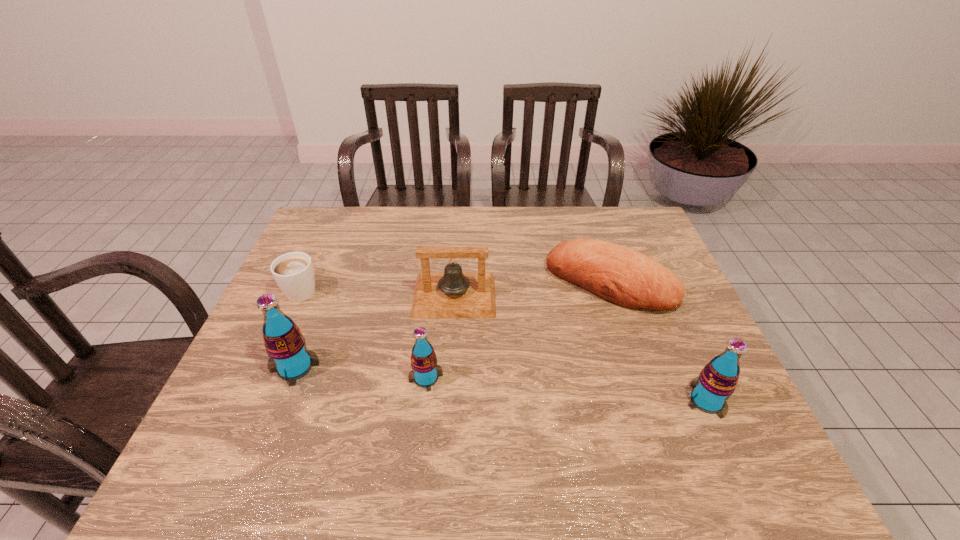
To achieve even spacing by inserting another pop_(soda) among them, please point to a vacant spot for this new pop_(soda). Please provide its 2D coordinates. Your answer should be formatted as a tuple, i.e. [(x, y)], where the tuple contains the x and y coordinates of a point satisfying the conditions above.

[(564, 389)]